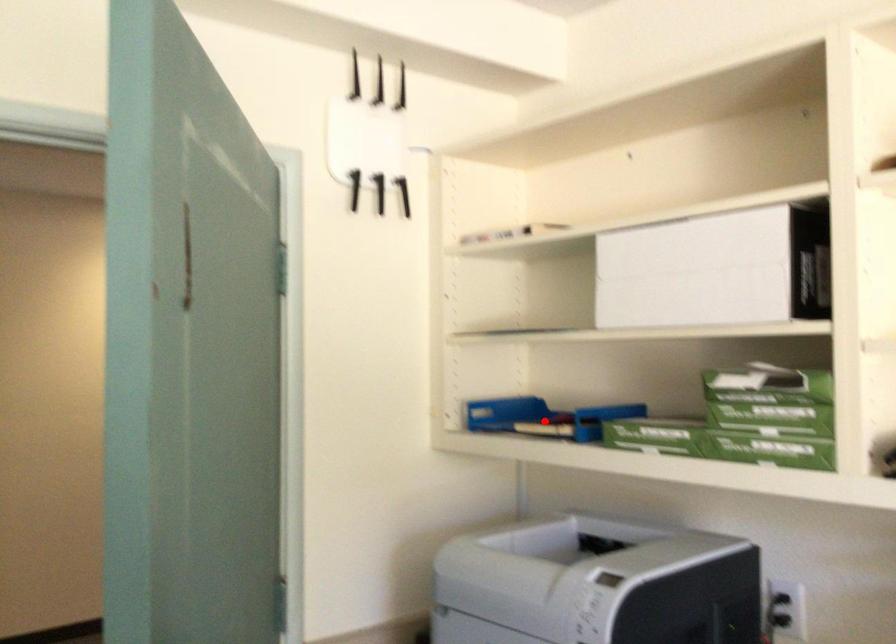
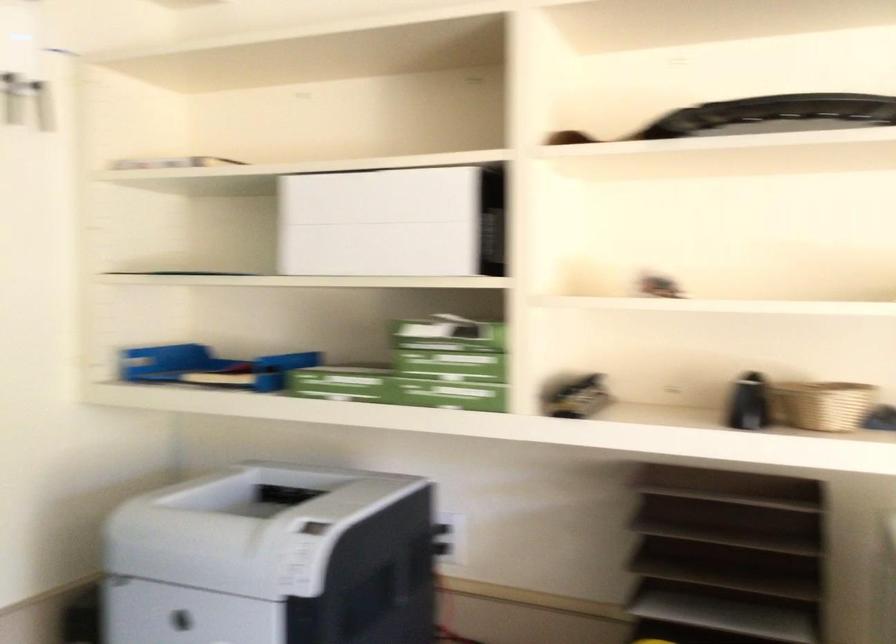
Locate, in the second image, the point that corresponds to the highlighted location in the first image.

(209, 366)